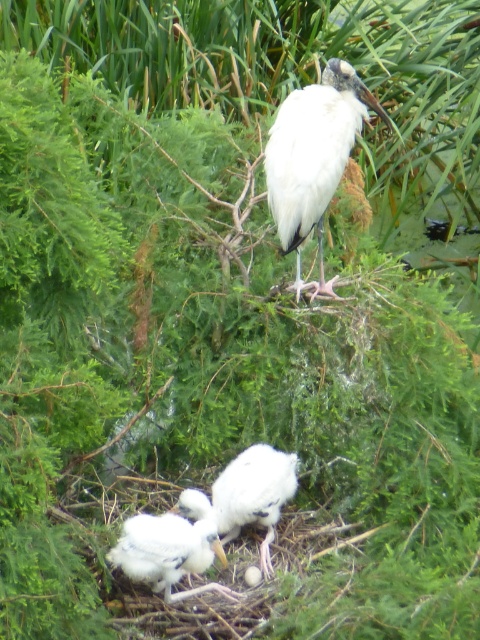
Question: Does white smooth stork at center have a greater width compared to white fluffy bird at lower center?

Choices:
 (A) yes
 (B) no

Answer: (A)

Question: Is white smooth stork at center to the left of white fluffy bird at center from the viewer's perspective?

Choices:
 (A) yes
 (B) no

Answer: (B)

Question: Which of the following is the farthest from the observer?

Choices:
 (A) (321, 150)
 (B) (156, 531)

Answer: (A)

Question: Is white fluffy bird at lower center smaller than white fluffy bird at center?

Choices:
 (A) no
 (B) yes

Answer: (B)

Question: Which of the following is the closest to the observer?

Choices:
 (A) (288, 108)
 (B) (163, 577)
 (C) (295, 483)

Answer: (B)

Question: Which of the following is the closest to the observer?

Choices:
 (A) (142, 547)
 (B) (259, 451)

Answer: (A)